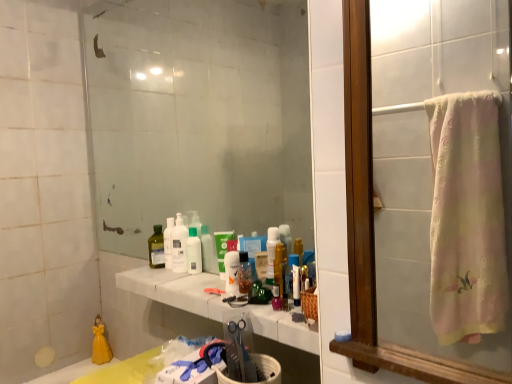
Question: Relative to translucent plastic mouthwash at center, the 3th mouthwash positioned from the front, is white marble counter at center in front or behind?

Choices:
 (A) behind
 (B) front

Answer: (B)

Question: Is point (280, 327) positioned closer to the camera than point (196, 269)?

Choices:
 (A) farther
 (B) closer

Answer: (B)

Question: Which is nearer to the white marble counter at center?

Choices:
 (A) pink fabric towel at right, arranged as the second mirror when viewed from the left
 (B) transparent glass mirror at center, the second mirror from the right
 (C) yellow porcelain doll at lower left
 (D) translucent plastic spray bottle at center, which appears as the second cleaning product when viewed from the left
 (E) white glossy bottle at center, which is counted as the second cleaning product, starting from the front

Answer: (E)

Question: Considering the real-world distances, which object is closest to the pink fabric towel at right, the 2th mirror from the back?

Choices:
 (A) yellow porcelain doll at lower left
 (B) translucent plastic spray bottle at center, which appears as the second cleaning product when viewed from the left
 (C) white marble counter at center
 (D) translucent plastic mouthwash at center, the 1th mouthwash viewed from the front
 (E) transparent glass mirror at center, which is counted as the first mirror, starting from the left

Answer: (C)